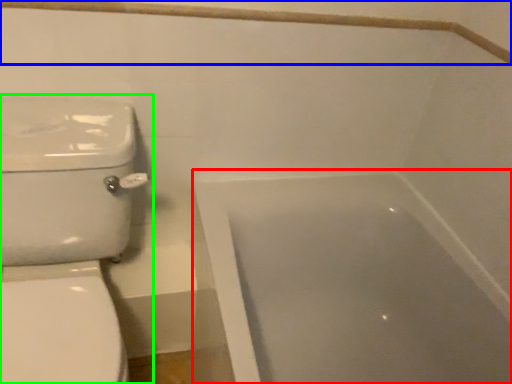
Question: Estimate the real-world distances between objects in this image. Which object is farther from bathtub (highlighted by a red box), balustrade (highlighted by a blue box) or toilet (highlighted by a green box)?

Choices:
 (A) balustrade
 (B) toilet

Answer: (A)